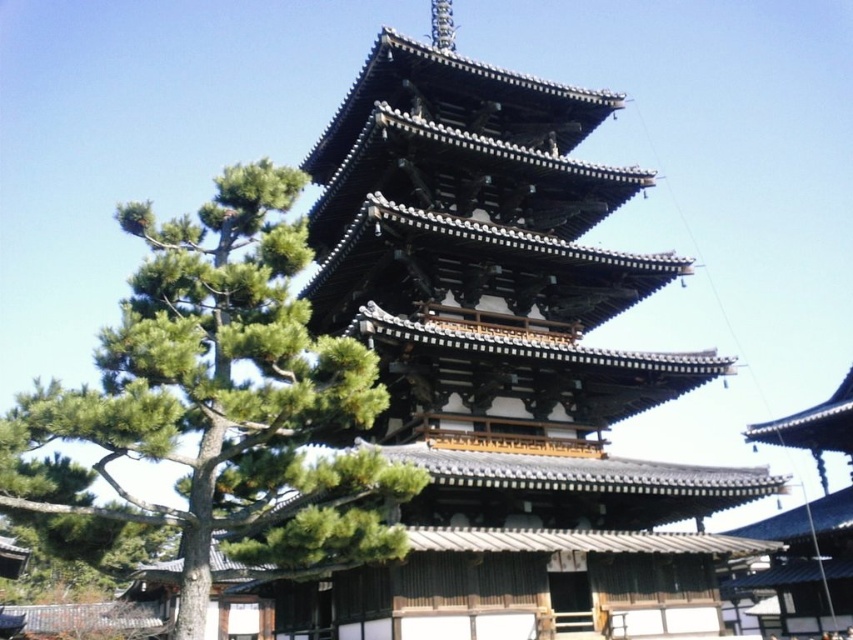
You are a gardener standing next to the green leafy tree at left and need to water the shiny dark brown wooden pagoda at center. Since the watering hose can only reach 3 meters, will you be able to water the pagoda without moving the hose?

The distance between the shiny dark brown wooden pagoda at center and the green leafy tree at left is 3.77 meters, which is longer than the 3 meter reach of the hose. Therefore, you cannot water the pagoda without moving the hose.

You are a landscape architect designing a garden path that needs to pass between the shiny dark brown wooden pagoda at center and the green leafy tree at left. Given that the path must be at least 2 meters wide to accommodate visitors, can the existing space between them accommodate this requirement?

The shiny dark brown wooden pagoda at center is wider than the green leafy tree at left. However, without specific measurements of the distance between them, it is impossible to determine if the path can be 2 meters wide. More information about their separation is needed.